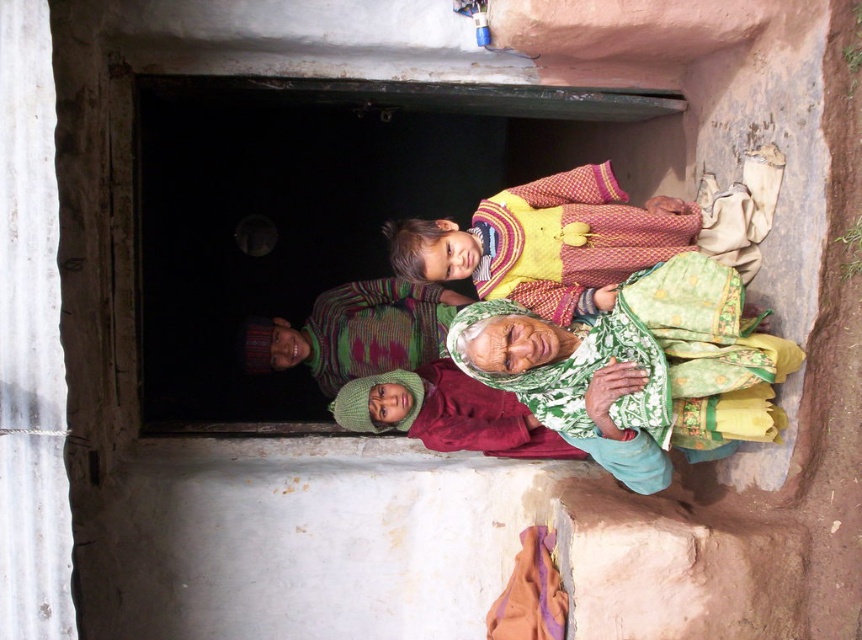
Looking at this image, is transparent glass window at center below green knitted hat at lower center?

Incorrect, transparent glass window at center is not positioned below green knitted hat at lower center.

Is transparent glass window at center bigger than green knitted hat at lower center?

Correct, transparent glass window at center is larger in size than green knitted hat at lower center.

Locate an element on the screen. The image size is (862, 640). transparent glass window at center is located at coordinates pos(303,216).

Does knitted sweater at center have a greater height compared to knitted green hat at center?

Correct, knitted sweater at center is much taller as knitted green hat at center.

Who is more forward, (340, 342) or (513, 442)?

Point (513, 442) is in front.

Identify the location of knitted sweater at center. The width and height of the screenshot is (862, 640). (354, 332).

Which is above, green knitted hat at lower center or knitted green hat at center?

green knitted hat at lower center is above.

Can you confirm if green knitted hat at lower center is positioned to the left of knitted green hat at center?

No, green knitted hat at lower center is not to the left of knitted green hat at center.

The width and height of the screenshot is (862, 640). Describe the element at coordinates (639, 369) in the screenshot. I see `green knitted hat at lower center` at that location.

You are a GUI agent. You are given a task and a screenshot of the screen. Output one action in this format:
    pyautogui.click(x=<x>, y=<y>)
    Task: Click on the green knitted hat at lower center
    The image size is (862, 640).
    Given the screenshot: What is the action you would take?
    pyautogui.click(x=639, y=369)